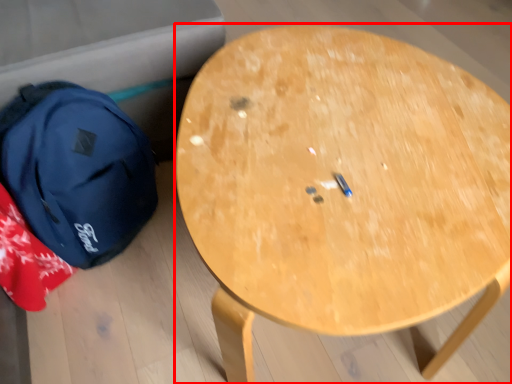
Question: Considering the relative positions of table (annotated by the red box) and backpack in the image provided, where is table (annotated by the red box) located with respect to the staircase?

Choices:
 (A) left
 (B) right

Answer: (B)